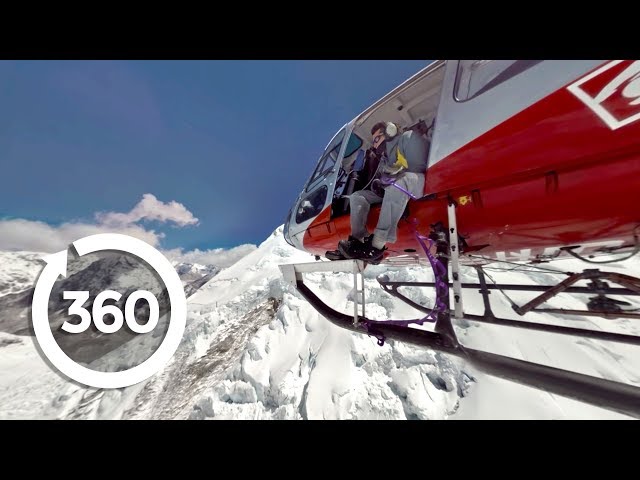
The image size is (640, 480). I want to click on open door, so click(422, 105).